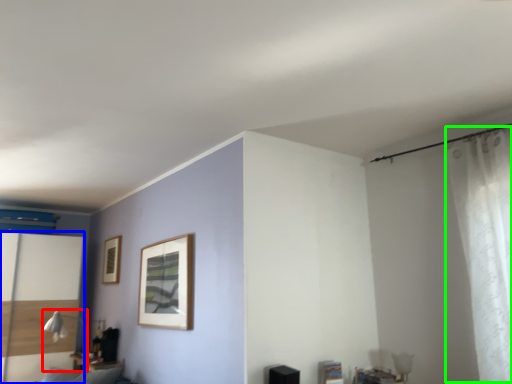
Question: Which object is the closest to the table lamp (highlighted by a red box)? Choose among these: screen door (highlighted by a blue box) or curtain (highlighted by a green box).

Choices:
 (A) screen door
 (B) curtain

Answer: (A)